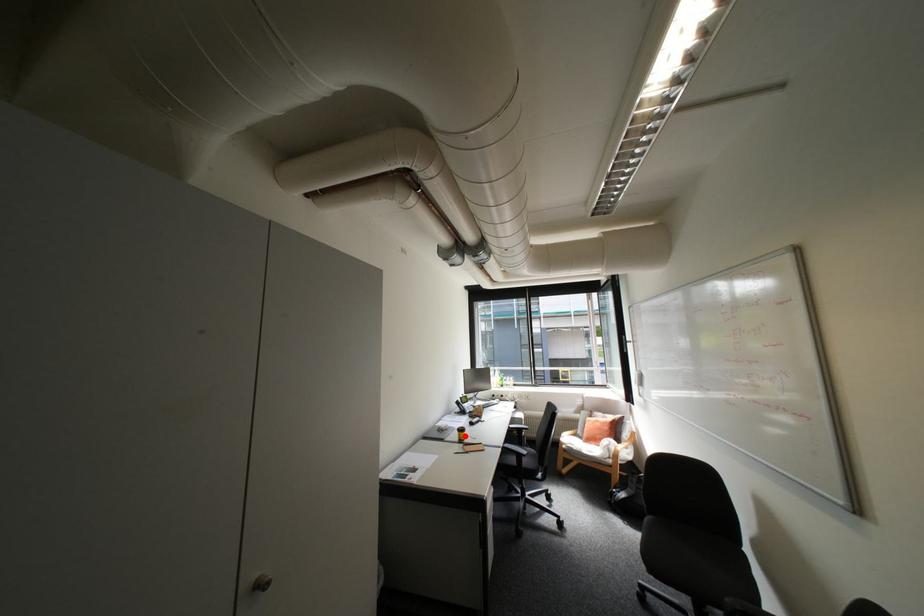
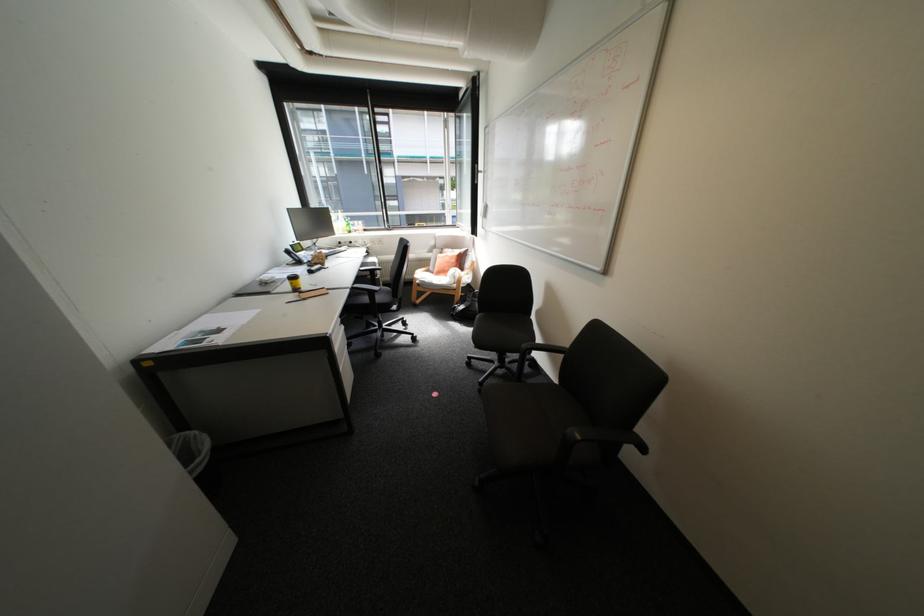
In the second image, find the point that corresponds to the highlighted location in the first image.

(296, 286)